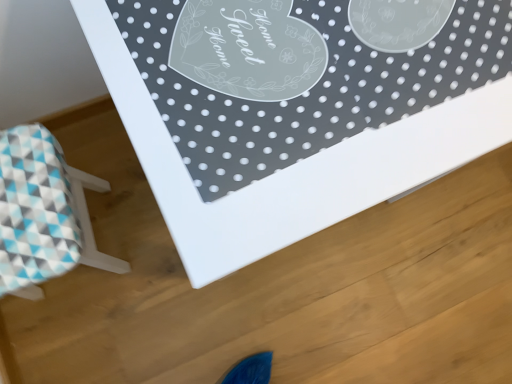
Question: From the image's perspective, is white glossy table at upper center positioned above or below blue checkered stool at lower left?

Choices:
 (A) below
 (B) above

Answer: (B)

Question: Is white glossy table at upper center wider or thinner than blue checkered stool at lower left?

Choices:
 (A) thin
 (B) wide

Answer: (B)

Question: From a real-world perspective, relative to blue checkered stool at lower left, is white glossy table at upper center vertically above or below?

Choices:
 (A) below
 (B) above

Answer: (B)

Question: Is blue checkered stool at lower left bigger or smaller than white glossy table at upper center?

Choices:
 (A) small
 (B) big

Answer: (A)

Question: Does point (78, 228) appear closer or farther from the camera than point (184, 1)?

Choices:
 (A) farther
 (B) closer

Answer: (A)

Question: Would you say blue checkered stool at lower left is to the left or to the right of white glossy table at upper center in the picture?

Choices:
 (A) left
 (B) right

Answer: (A)

Question: From the image's perspective, relative to white glossy table at upper center, is blue checkered stool at lower left above or below?

Choices:
 (A) below
 (B) above

Answer: (A)